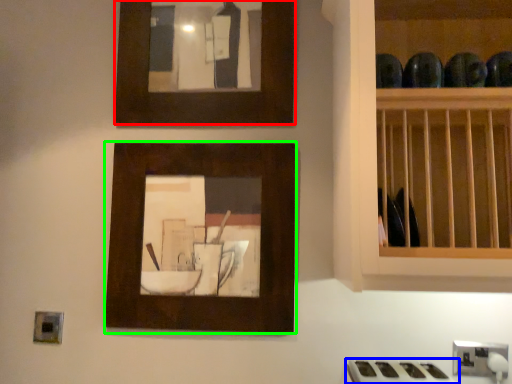
Question: Considering the real-world distances, which object is farthest from picture frame (highlighted by a red box)? gas stove (highlighted by a blue box) or picture frame (highlighted by a green box)?

Choices:
 (A) gas stove
 (B) picture frame

Answer: (A)